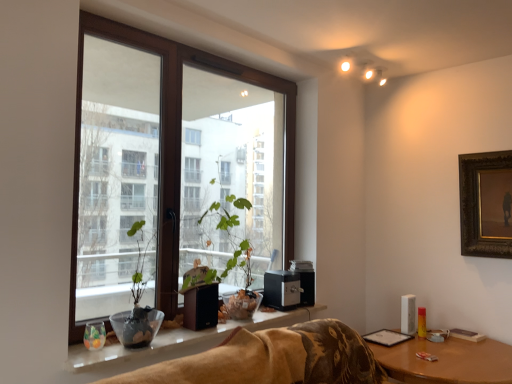
I want to click on vacant space in gold-framed painting at upper right (from a real-world perspective), so click(x=497, y=339).